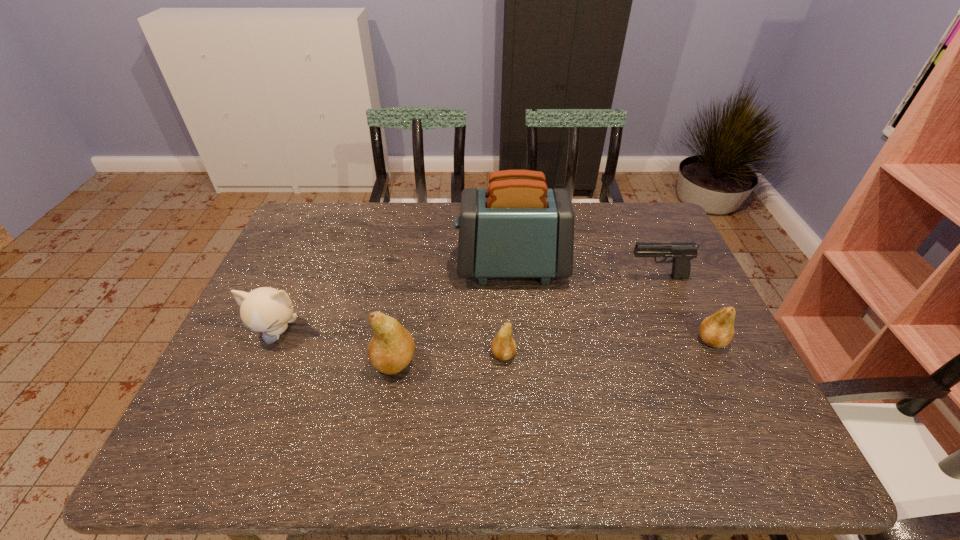
This screenshot has height=540, width=960. Identify the location of the second object from left to right. (391, 349).

This screenshot has height=540, width=960. I want to click on the leftmost pear, so click(x=391, y=349).

The height and width of the screenshot is (540, 960). I want to click on the second pear from left to right, so click(x=503, y=346).

The width and height of the screenshot is (960, 540). Identify the location of the second tallest pear. (717, 330).

The height and width of the screenshot is (540, 960). Identify the location of kitten. (268, 310).

Identify the location of the tallest object. (517, 227).

Where is `pistol`? Image resolution: width=960 pixels, height=540 pixels. pistol is located at coordinates [682, 252].

At what (x,y) coordinates should I click in order to perform the action: click on vacant space located 0.180m on the back of the leftmost pear. Please return your answer as a coordinate pair (x, y). Looking at the image, I should click on (406, 294).

At what (x,y) coordinates should I click in order to perform the action: click on free location located on the back of the shortest pear. Please return your answer as a coordinate pair (x, y). Looking at the image, I should click on tap(501, 299).

Image resolution: width=960 pixels, height=540 pixels. I want to click on vacant space positioned on the left of the rightmost pear, so click(539, 341).